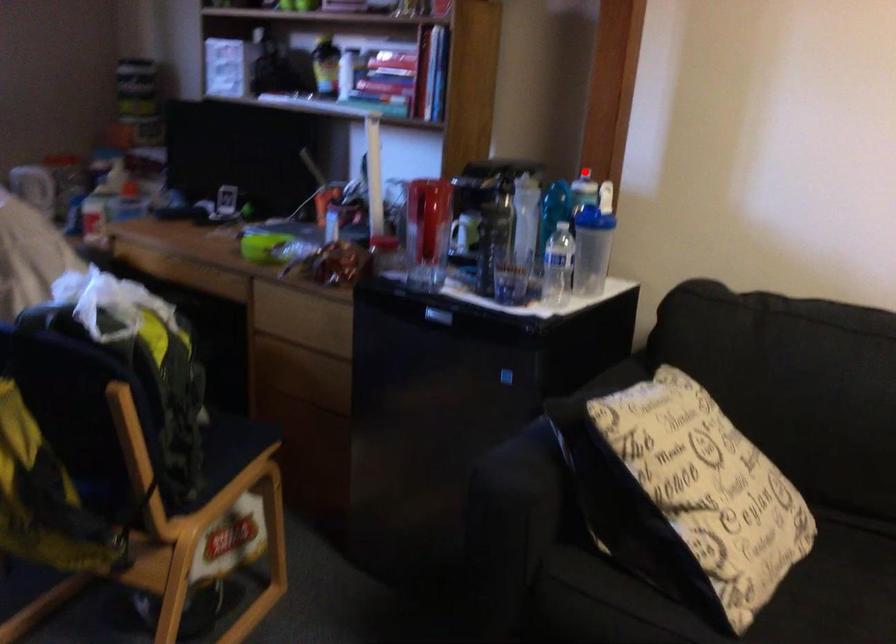
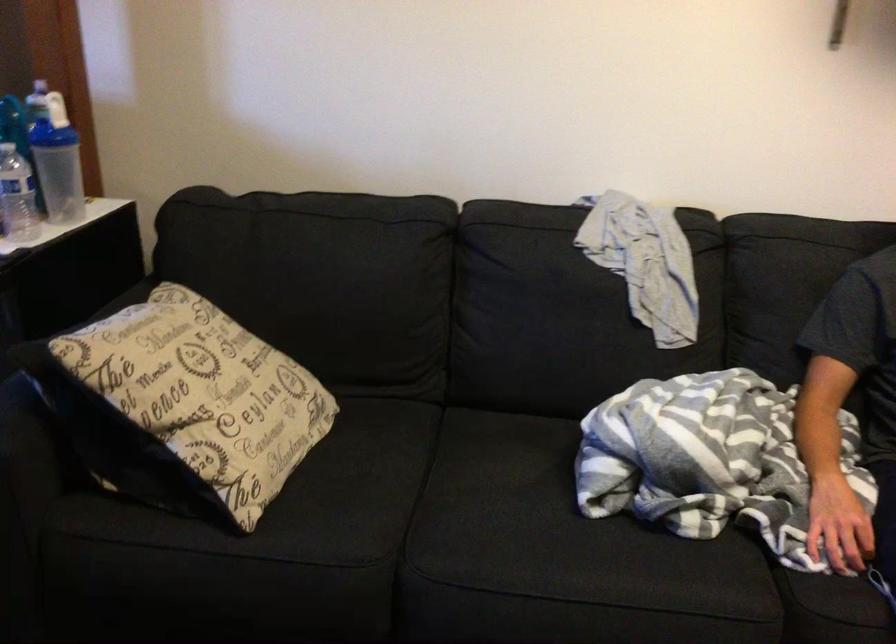
Question: A red point is marked in image1. In image2, is the corresponding 3D point closer to the camera or farther? Reply with the corresponding letter.

Choices:
 (A) The corresponding 3D point is closer.
 (B) The corresponding 3D point is farther.

Answer: (A)